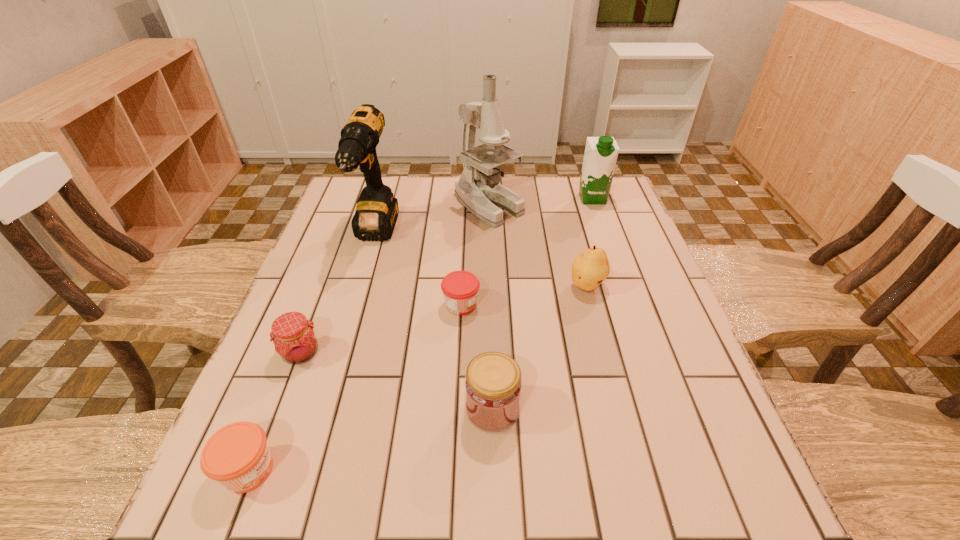
I want to click on object situated at the near edge, so click(x=237, y=456).

The image size is (960, 540). In order to click on drill that is at the left edge in this screenshot , I will do `click(376, 213)`.

You are a GUI agent. You are given a task and a screenshot of the screen. Output one action in this format:
    pyautogui.click(x=<x>, y=<y>)
    Task: Click on the soya milk that is at the right edge
    The image size is (960, 540).
    Given the screenshot: What is the action you would take?
    pyautogui.click(x=601, y=153)

In order to click on pear present at the right edge in this screenshot , I will do `click(589, 269)`.

Find the location of a particular element. This screenshot has height=540, width=960. object that is positioned at the far left corner is located at coordinates (376, 213).

At what (x,y) coordinates should I click in order to perform the action: click on object positioned at the near left corner. Please return your answer as a coordinate pair (x, y). The height and width of the screenshot is (540, 960). Looking at the image, I should click on (237, 456).

Locate an element on the screen. This screenshot has height=540, width=960. object located in the far right corner section of the desktop is located at coordinates (601, 153).

At what (x,y) coordinates should I click in order to perform the action: click on vacant space at the far edge of the desktop. Please return your answer as a coordinate pair (x, y). Looking at the image, I should click on (572, 210).

This screenshot has width=960, height=540. I want to click on free region at the near edge, so click(x=436, y=505).

This screenshot has height=540, width=960. In order to click on vacant space at the left edge in this screenshot , I will do `click(333, 339)`.